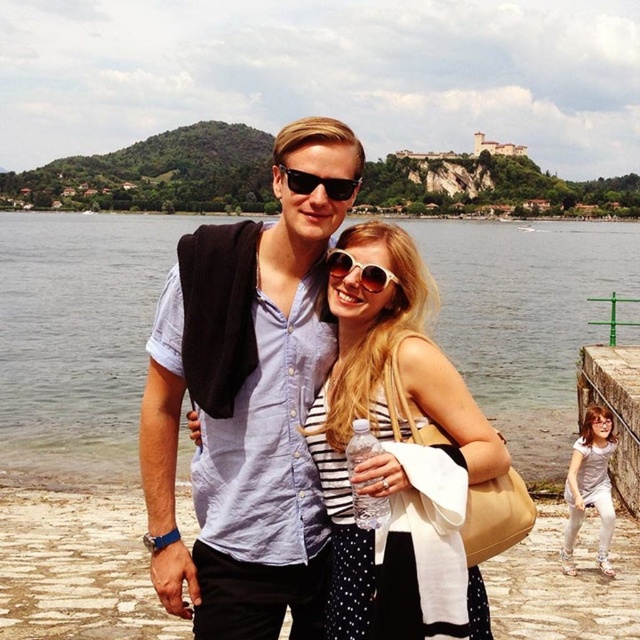
You are a photographer trying to capture a clear shot of the matte blue shirt at center and the black plastic sunglasses at center. Which object is closer to the camera?

The matte blue shirt at center is closer to the camera because it is in front of the black plastic sunglasses at center.

Where is the matte blue shirt at center located in the image?

The matte blue shirt at center is located at point 0.644 on the horizontal axis and 0.391 on the vertical axis.

You are a photographer trying to capture a photo of the light pink fabric dress at lower right and the sunglasses at center. Based on their positions, which object should you focus on first to ensure both are in frame without moving the camera?

The light pink fabric dress at lower right is taller than the sunglasses at center, so you should focus on the sunglasses at center first to ensure both are in frame without moving the camera.